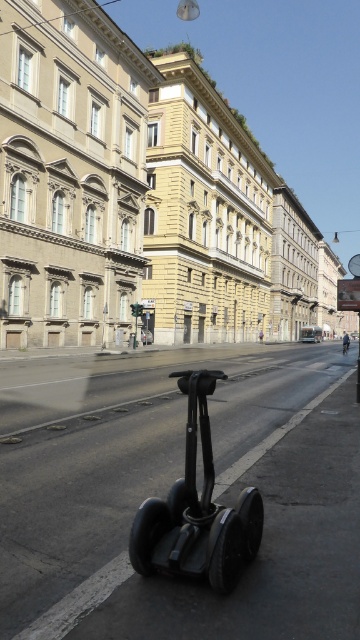
Does black rubber scooter at center appear on the left side of green metallic bus at center?

Indeed, black rubber scooter at center is positioned on the left side of green metallic bus at center.

Between point (205, 554) and point (317, 330), which one is positioned in front?

Point (205, 554) is in front.

Does point (141, 545) lie behind point (300, 330)?

That is False.

Image resolution: width=360 pixels, height=640 pixels. Identify the location of black rubber scooter at center. (196, 509).